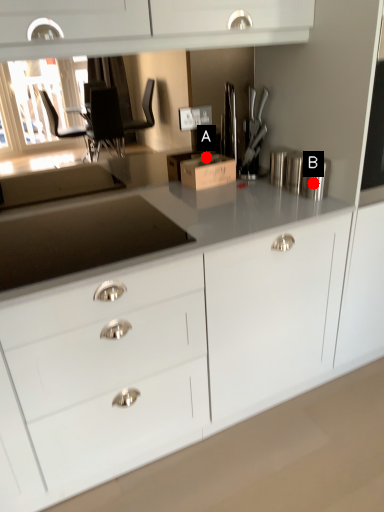
Question: Two points are circled on the image, labeled by A and B beside each circle. Which point is closer to the camera?

Choices:
 (A) A is closer
 (B) B is closer

Answer: (B)